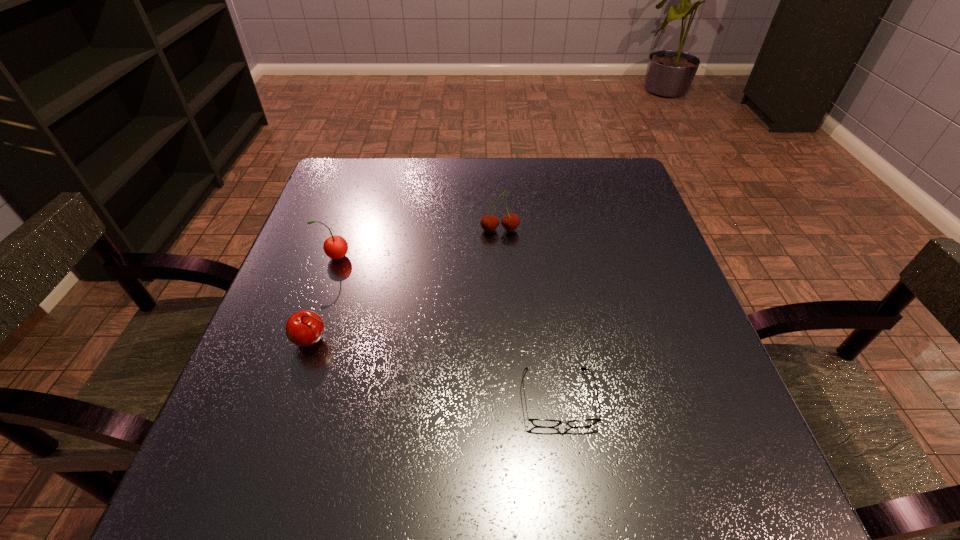
Locate an element on the screen. the rightmost cherry is located at coordinates (489, 223).

Image resolution: width=960 pixels, height=540 pixels. In order to click on the farthest cherry in this screenshot , I will do `click(489, 223)`.

The width and height of the screenshot is (960, 540). Find the location of `the second nearest cherry`. the second nearest cherry is located at coordinates (335, 247).

This screenshot has height=540, width=960. I want to click on the third tallest object, so click(x=305, y=328).

Identify the location of the nearest cherry. (305, 328).

Where is `spectacles`? The height and width of the screenshot is (540, 960). spectacles is located at coordinates (543, 423).

Where is `the shortest object`? This screenshot has height=540, width=960. the shortest object is located at coordinates (543, 423).

You are a GUI agent. You are given a task and a screenshot of the screen. Output one action in this format:
    pyautogui.click(x=<x>, y=<y>)
    Task: Click on the vacant space located 0.360m on the surface of the rightmost cherry
    The image size is (960, 540).
    Given the screenshot: What is the action you would take?
    pyautogui.click(x=507, y=368)

Find the location of a particular element. The image size is (960, 540). vacant region located on the front of the second farthest object is located at coordinates (303, 352).

Locate an element on the screen. Image resolution: width=960 pixels, height=540 pixels. free location located 0.080m on the back of the shortest cherry is located at coordinates (327, 295).